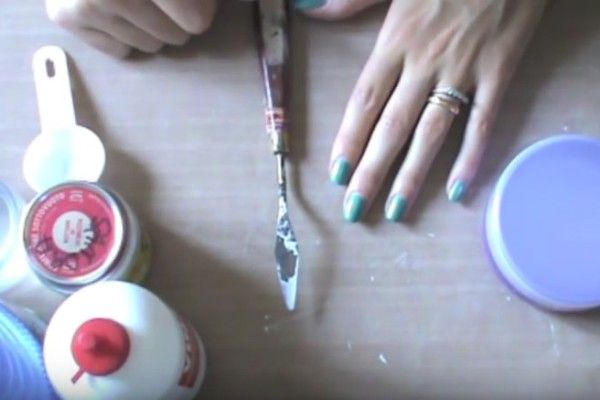
At what (x,y) coordinates should I click in order to perform the action: click on measuring cup. Please return your answer as a coordinate pair (x, y). Image resolution: width=600 pixels, height=400 pixels. Looking at the image, I should click on (65, 165).